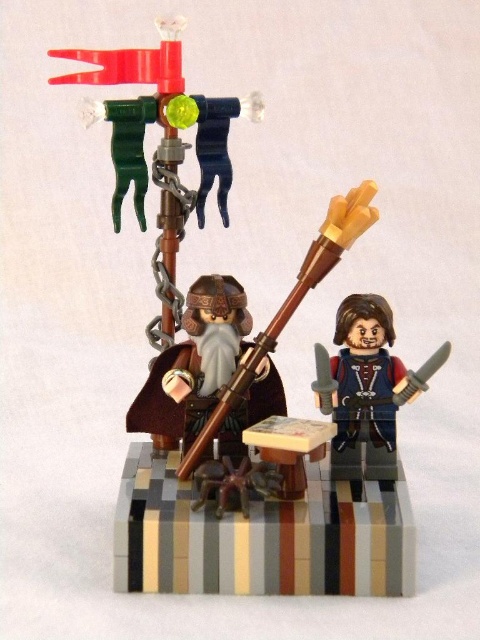
Question: Is blue fabric vest at center bigger than wooden spear at center?

Choices:
 (A) no
 (B) yes

Answer: (A)

Question: Does blue fabric vest at center appear over wooden spear at center?

Choices:
 (A) no
 (B) yes

Answer: (A)

Question: Does blue fabric vest at center lie in front of wooden spear at center?

Choices:
 (A) no
 (B) yes

Answer: (A)

Question: Which of the following is the farthest from the observer?

Choices:
 (A) (384, 356)
 (B) (315, 252)

Answer: (A)